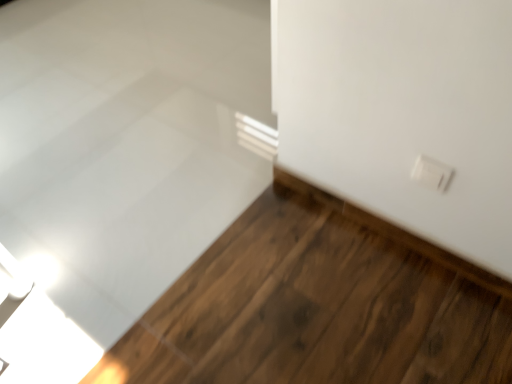
Where is `white plastic electric outlet at upper right`? The width and height of the screenshot is (512, 384). white plastic electric outlet at upper right is located at coordinates (431, 173).

Describe the element at coordinates (431, 173) in the screenshot. The image size is (512, 384). I see `white plastic electric outlet at upper right` at that location.

Identify the location of white plastic electric outlet at upper right. The width and height of the screenshot is (512, 384). (431, 173).